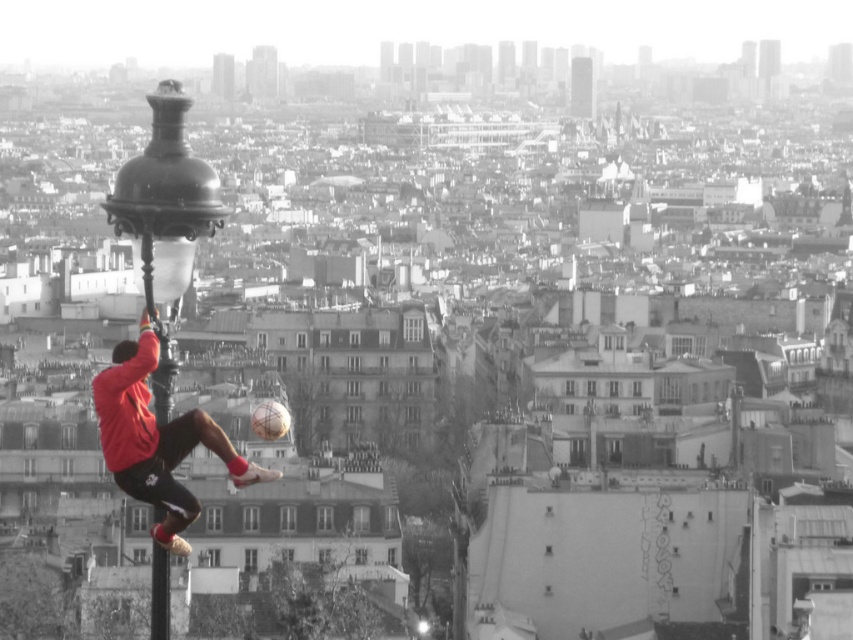
Does polished brass lamp post at left come in front of polished metal pole at left?

Yes, polished brass lamp post at left is in front of polished metal pole at left.

Can you confirm if polished brass lamp post at left is taller than polished metal pole at left?

Yes, polished brass lamp post at left is taller than polished metal pole at left.

Describe the element at coordinates (164, 211) in the screenshot. The height and width of the screenshot is (640, 853). I see `polished brass lamp post at left` at that location.

Where is `polished brass lamp post at left`? The height and width of the screenshot is (640, 853). polished brass lamp post at left is located at coordinates (164, 211).

Can you confirm if red matte soccer player at center is smaller than polished metal pole at left?

No, red matte soccer player at center is not smaller than polished metal pole at left.

Which is above, red matte soccer player at center or polished metal pole at left?

Positioned higher is red matte soccer player at center.

Image resolution: width=853 pixels, height=640 pixels. Identify the location of red matte soccer player at center. (157, 440).

How far apart are polished brass lamp post at left and red matte soccer player at center?

polished brass lamp post at left is 30.89 feet away from red matte soccer player at center.

Which is in front, point (148, 218) or point (154, 532)?

Point (148, 218)

Identify the location of polished brass lamp post at left. (164, 211).